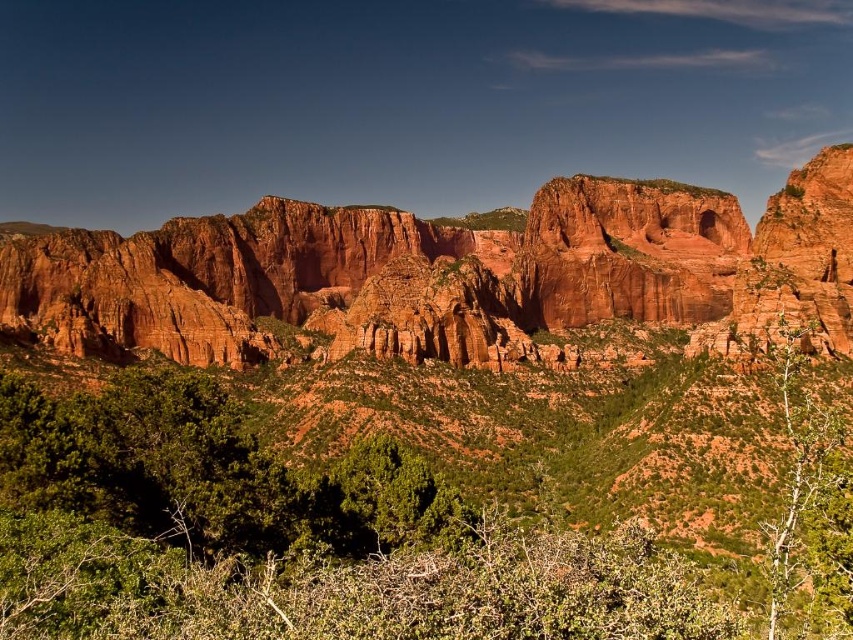
Based on the scene description, what does the point at coordinates (445, 273) represent?

The point at coordinates (445, 273) indicates a rustic rock formation at the center of the image.

You are a hiker standing at the edge of the canyon. You notice both the rustic rock formation at center and the green leafy tree at center. Which one do you think is wider from your viewpoint?

The rustic rock formation at center might be wider than the green leafy tree at center, so the rock formation is likely wider from your viewpoint.